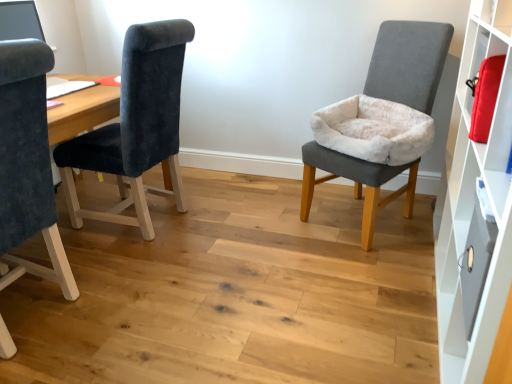
Locate an element on the screen. vacant space underneath velvet gray chair at right, acting as the third chair starting from the left (from a real-world perspective) is located at coordinates (360, 218).